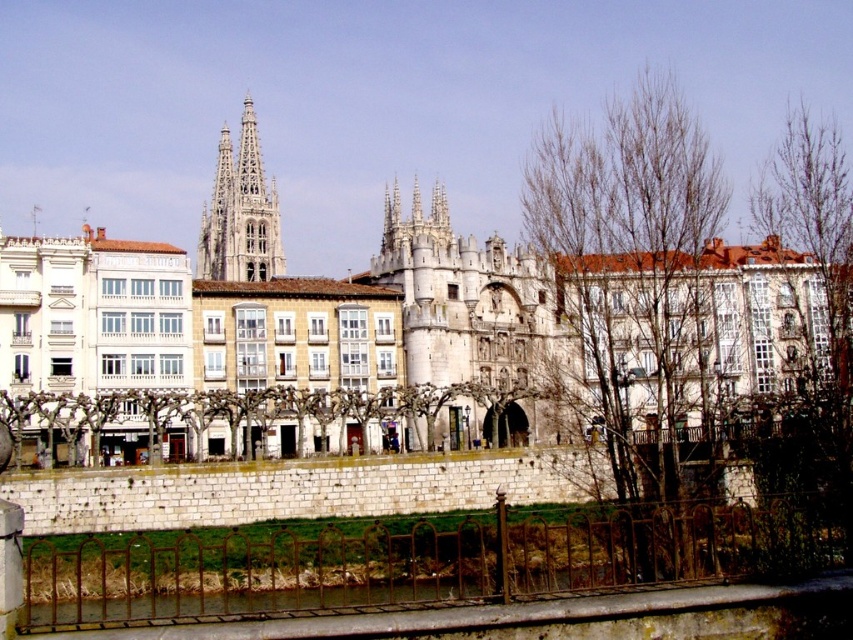
You are an architect analyzing the urban scene. You notice the bare branches at right and the smooth stone spire at center. Which of these two elements occupies a greater visual area in the image?

The bare branches at right has a larger size compared to the smooth stone spire at center, so the bare branches at right occupies a greater visual area in the image.

You are a tourist standing at the entrance of the historic cathedral. You notice a tree with bare branches at center. Where exactly is this tree positioned relative to the cathedral?

The bare branches at center is located at point (631, 266) relative to the cathedral, which places it near the central area in front of the building.